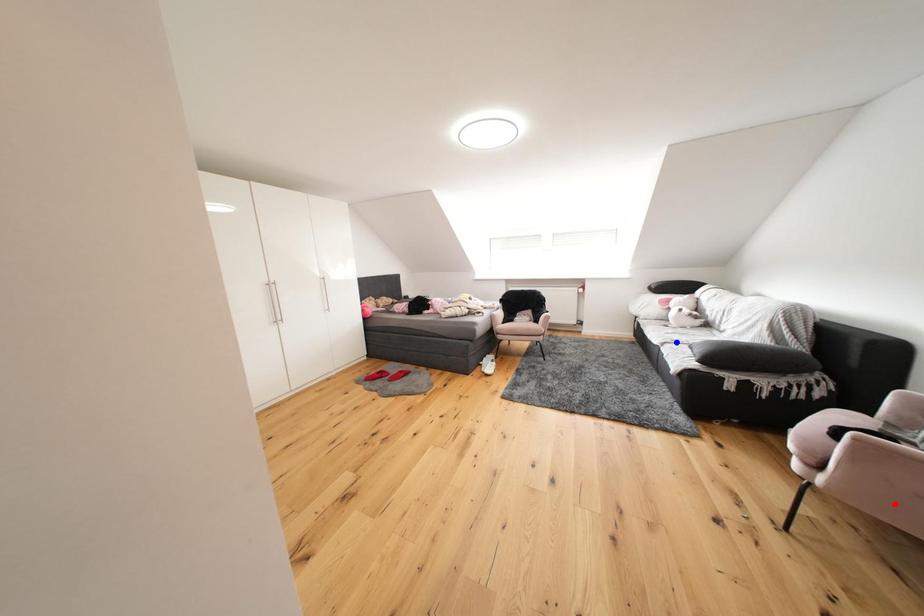
Question: Two points are marked on the image. Which point is closer to the camera?

Choices:
 (A) Blue point is closer.
 (B) Red point is closer.

Answer: (B)